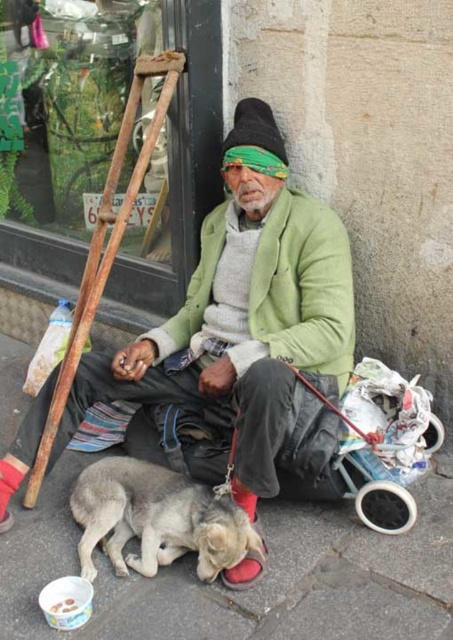
Is green knitted jacket at center positioned behind fuzzy gray dog at lower left?

Yes, green knitted jacket at center is behind fuzzy gray dog at lower left.

Can you confirm if green knitted jacket at center is smaller than fuzzy gray dog at lower left?

Incorrect, green knitted jacket at center is not smaller in size than fuzzy gray dog at lower left.

This screenshot has width=453, height=640. Identify the location of green knitted jacket at center. (244, 314).

What do you see at coordinates (251, 584) in the screenshot? The width and height of the screenshot is (453, 640). I see `gray concrete pavement at lower center` at bounding box center [251, 584].

Can you confirm if gray concrete pavement at lower center is shorter than green matte jacket at center?

Yes.

Is point (406, 577) positioned before point (318, 337)?

Yes, point (406, 577) is in front of point (318, 337).

You are a GUI agent. You are given a task and a screenshot of the screen. Output one action in this format:
    pyautogui.click(x=<x>, y=<y>)
    Task: Click on the gray concrete pavement at lower center
    The height and width of the screenshot is (640, 453).
    Given the screenshot: What is the action you would take?
    coord(251,584)

Does green knitted jacket at center have a greater height compared to gray concrete pavement at lower center?

Yes.

Who is positioned more to the left, green knitted jacket at center or gray concrete pavement at lower center?

Positioned to the left is green knitted jacket at center.

Locate an element on the screen. The width and height of the screenshot is (453, 640). green knitted jacket at center is located at coordinates (244, 314).